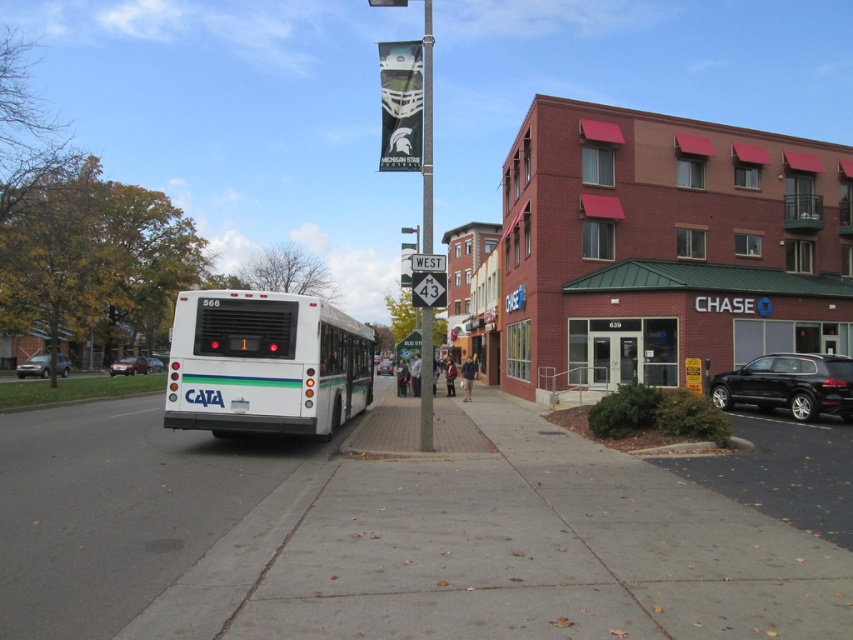
Does white matte bus at center come in front of metallic pole at center?

That is True.

Is white matte bus at center above metallic pole at center?

No, white matte bus at center is not above metallic pole at center.

Locate an element on the screen. This screenshot has height=640, width=853. white matte bus at center is located at coordinates (265, 364).

Is point (38, 368) behind point (138, 358)?

No, (38, 368) is in front of (138, 358).

Is silver metallic sedan at lower left wider than silver metallic sedan at left?

Indeed, silver metallic sedan at lower left has a greater width compared to silver metallic sedan at left.

The height and width of the screenshot is (640, 853). What do you see at coordinates (33, 365) in the screenshot?
I see `silver metallic sedan at lower left` at bounding box center [33, 365].

The width and height of the screenshot is (853, 640). Identify the location of silver metallic sedan at lower left. (33, 365).

Between shiny black suv at right and white glass door at center, which one is positioned higher?

Positioned higher is white glass door at center.

Is the position of shiny black suv at right less distant than that of white glass door at center?

That is True.

This screenshot has width=853, height=640. What do you see at coordinates (788, 385) in the screenshot?
I see `shiny black suv at right` at bounding box center [788, 385].

Find the location of a particular element. The image size is (853, 640). shiny black suv at right is located at coordinates (788, 385).